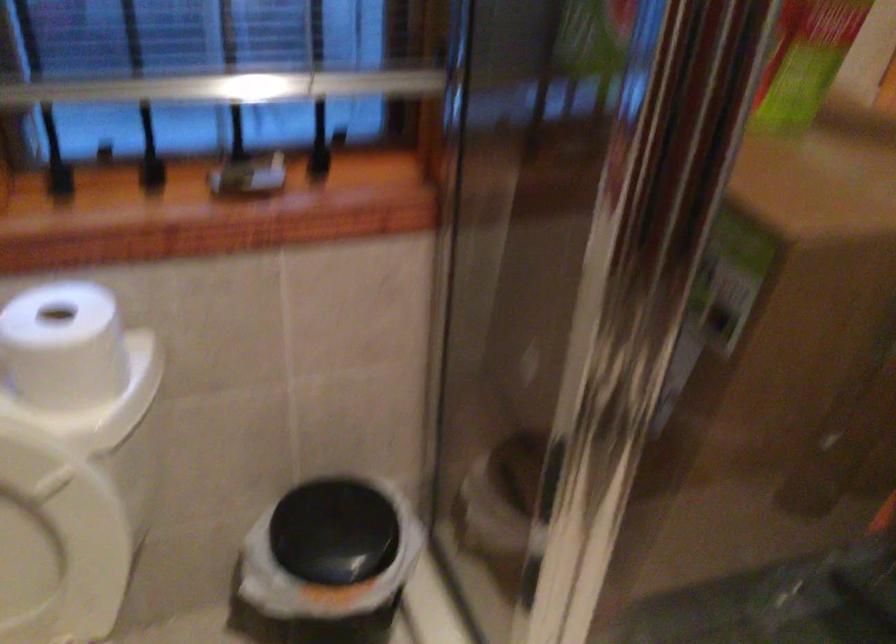
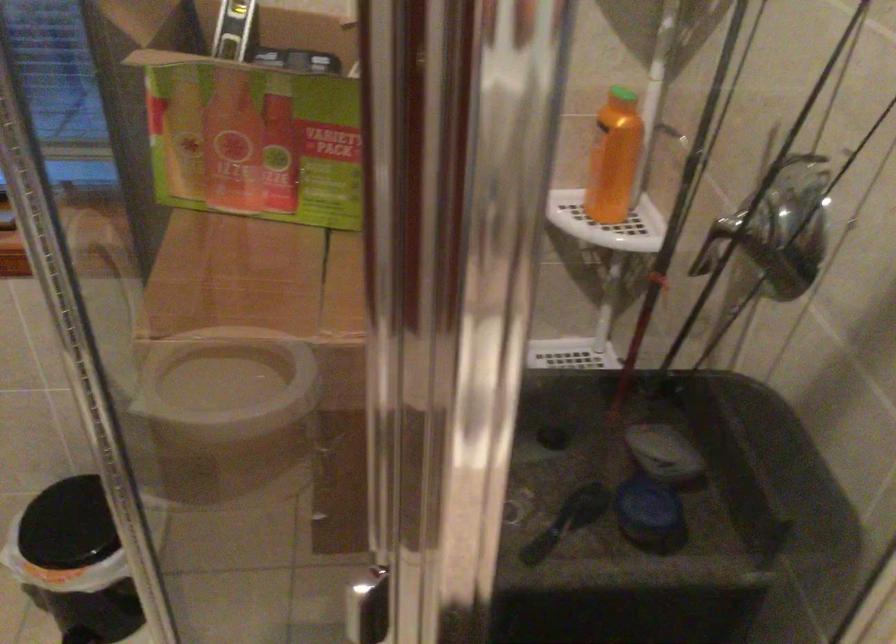
In the second image, find the point that corresponds to the point at 340,536 in the first image.

(67, 525)